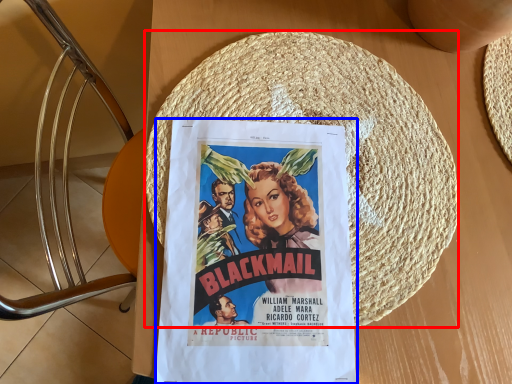
Question: Among these objects, which one is nearest to the camera, straw hat (highlighted by a red box) or poster (highlighted by a blue box)?

Choices:
 (A) straw hat
 (B) poster

Answer: (B)